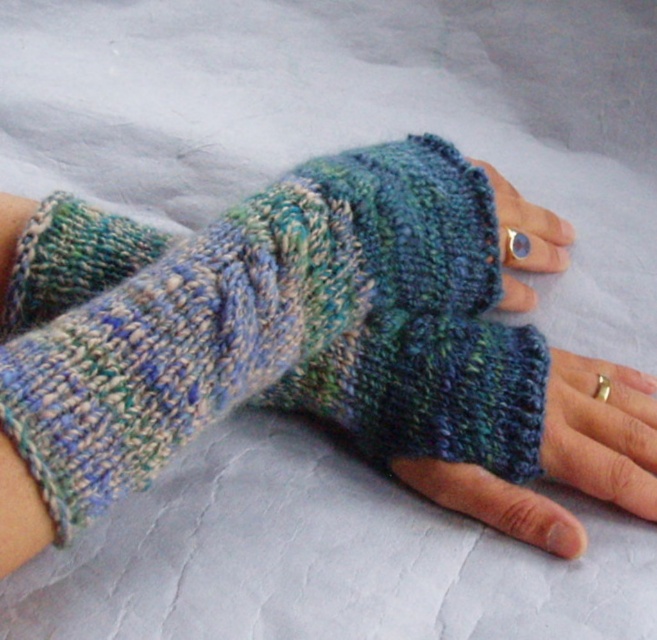
Can you confirm if multicolored knitted fingerless gloves at center is positioned below knitted wool fingerless glove at center?

No, multicolored knitted fingerless gloves at center is not below knitted wool fingerless glove at center.

Is multicolored knitted fingerless gloves at center shorter than knitted wool fingerless glove at center?

In fact, multicolored knitted fingerless gloves at center may be taller than knitted wool fingerless glove at center.

Locate an element on the screen. This screenshot has width=657, height=640. multicolored knitted fingerless gloves at center is located at coordinates (263, 323).

At what (x,y) coordinates should I click in order to perform the action: click on multicolored knitted fingerless gloves at center. Please return your answer as a coordinate pair (x, y). The width and height of the screenshot is (657, 640). Looking at the image, I should click on (263, 323).